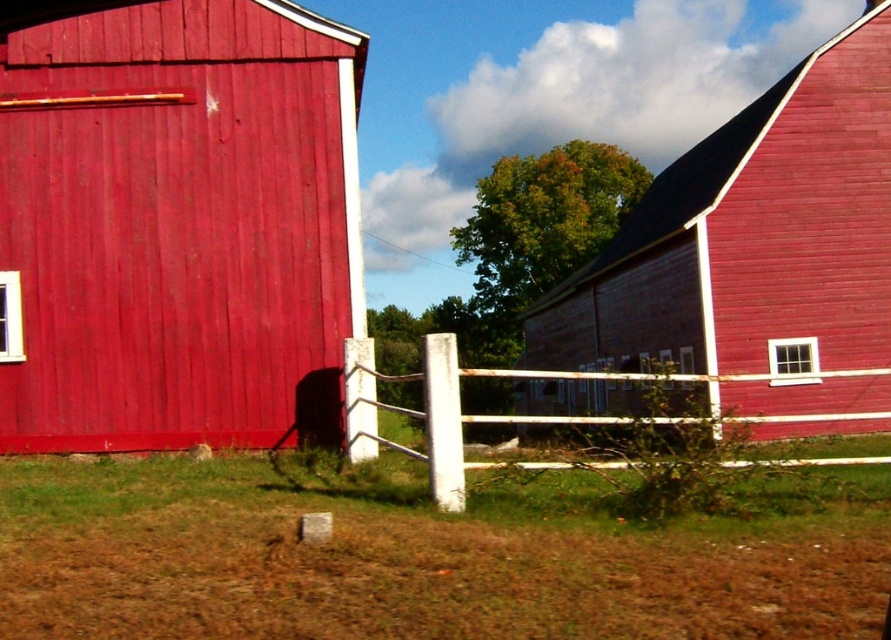
Question: Is smooth wooden barn at center bigger than white wooden fence at center?

Choices:
 (A) no
 (B) yes

Answer: (B)

Question: Does matte wood barn at center appear over white wooden fence at center?

Choices:
 (A) no
 (B) yes

Answer: (B)

Question: Estimate the real-world distances between objects in this image. Which object is farther from the white wooden fence at center?

Choices:
 (A) smooth wooden barn at center
 (B) matte wood barn at center

Answer: (A)

Question: Which of the following is the farthest from the observer?

Choices:
 (A) (846, 410)
 (B) (48, 369)
 (C) (454, 358)

Answer: (A)

Question: Is matte wood barn at center positioned in front of white wooden fence at center?

Choices:
 (A) yes
 (B) no

Answer: (B)

Question: Among these points, which one is nearest to the camera?

Choices:
 (A) (791, 381)
 (B) (30, 310)
 (C) (354, 419)

Answer: (C)